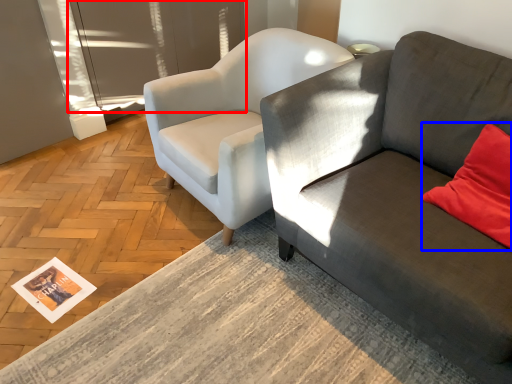
Question: Which of the following is the farthest to the observer, glass door (highlighted by a red box) or pillow (highlighted by a blue box)?

Choices:
 (A) glass door
 (B) pillow

Answer: (A)